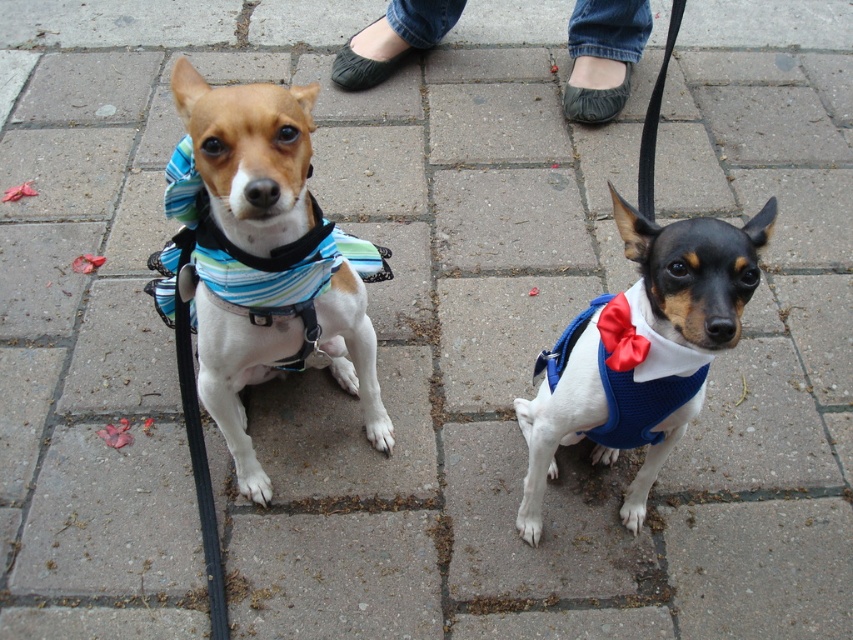
Who is taller, jeans at center or blue striped fabric harness at center?

Standing taller between the two is jeans at center.

Between jeans at center and blue striped fabric harness at center, which one appears on the right side from the viewer's perspective?

Positioned to the right is jeans at center.

Identify the location of jeans at center. (602, 56).

Who is more distant from viewer, (741, 241) or (598, 323)?

The point (598, 323) is more distant.

Which is more to the right, blue knitted vest at center or satin blue bow tie at center?

Positioned to the right is blue knitted vest at center.

Between point (602, 413) and point (631, 352), which one is positioned in front?

Point (631, 352) is in front.

Locate an element on the screen. blue knitted vest at center is located at coordinates (646, 355).

Is striped fabric vest at center shorter than blue striped fabric harness at center?

No, striped fabric vest at center is not shorter than blue striped fabric harness at center.

What do you see at coordinates (265, 260) in the screenshot?
I see `striped fabric vest at center` at bounding box center [265, 260].

Who is more forward, (339, 243) or (277, 301)?

Positioned in front is point (277, 301).

Where is `striped fabric vest at center`? striped fabric vest at center is located at coordinates (265, 260).